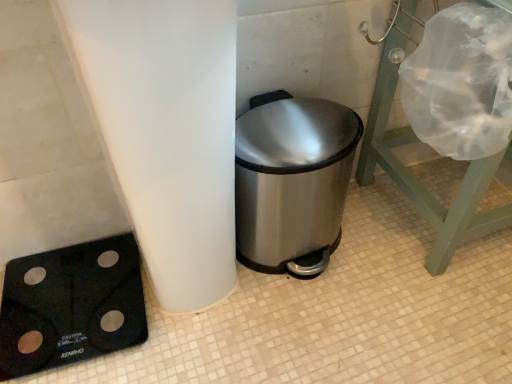
Question: Does black rubberized scale at lower left have a greater height compared to stainless steel trash can at center?

Choices:
 (A) yes
 (B) no

Answer: (B)

Question: Considering the relative positions of black rubberized scale at lower left and stainless steel trash can at center in the image provided, is black rubberized scale at lower left to the left of stainless steel trash can at center from the viewer's perspective?

Choices:
 (A) no
 (B) yes

Answer: (B)

Question: Are black rubberized scale at lower left and stainless steel trash can at center located far from each other?

Choices:
 (A) yes
 (B) no

Answer: (B)

Question: Is black rubberized scale at lower left at the right side of stainless steel trash can at center?

Choices:
 (A) no
 (B) yes

Answer: (A)

Question: Is black rubberized scale at lower left bigger than stainless steel trash can at center?

Choices:
 (A) no
 (B) yes

Answer: (A)

Question: From the image's perspective, relative to stainless steel trash can at center, is transparent plastic shower cap at upper right above or below?

Choices:
 (A) above
 (B) below

Answer: (A)

Question: From a real-world perspective, is transparent plastic shower cap at upper right positioned above or below stainless steel trash can at center?

Choices:
 (A) above
 (B) below

Answer: (A)

Question: In terms of height, does transparent plastic shower cap at upper right look taller or shorter compared to stainless steel trash can at center?

Choices:
 (A) short
 (B) tall

Answer: (B)

Question: Relative to stainless steel trash can at center, is transparent plastic shower cap at upper right in front or behind?

Choices:
 (A) front
 (B) behind

Answer: (A)

Question: Is point (306, 132) closer or farther from the camera than point (137, 289)?

Choices:
 (A) closer
 (B) farther

Answer: (A)

Question: Is stainless steel trash can at center wider or thinner than black rubberized scale at lower left?

Choices:
 (A) wide
 (B) thin

Answer: (B)

Question: Which is correct: stainless steel trash can at center is inside black rubberized scale at lower left, or outside of it?

Choices:
 (A) inside
 (B) outside

Answer: (B)

Question: From the image's perspective, relative to black rubberized scale at lower left, is stainless steel trash can at center above or below?

Choices:
 (A) above
 (B) below

Answer: (A)

Question: Is point (8, 266) positioned closer to the camera than point (261, 201)?

Choices:
 (A) farther
 (B) closer

Answer: (A)

Question: Choose the correct answer: Is black rubberized scale at lower left inside stainless steel trash can at center or outside it?

Choices:
 (A) outside
 (B) inside

Answer: (A)